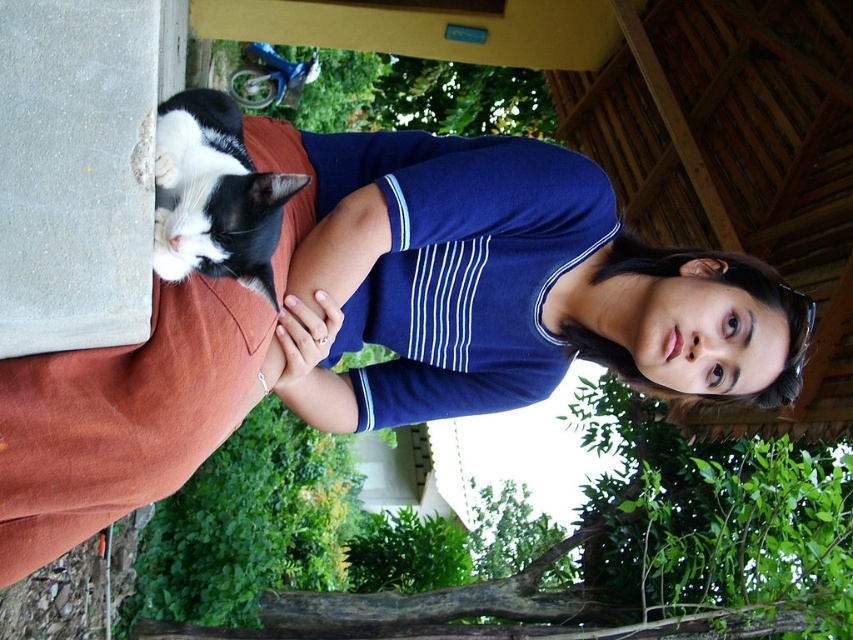
You are taking a photo of the matte blue shirt at center and the black and white fur cat at upper left. Which object should you focus on first to ensure both are in clear view?

The matte blue shirt at center is closer to the viewer than the black and white fur cat at upper left, so you should focus on the matte blue shirt at center first to ensure both are in clear view.

You are designing a costume for a theater play and need to ensure the matte blue shirt at center can fit over the black and white fur cat at upper left. Based on the image, will the shirt be large enough to cover the cat?

The matte blue shirt at center has a larger width than the black and white fur cat at upper left, so the shirt should be large enough to cover the cat.